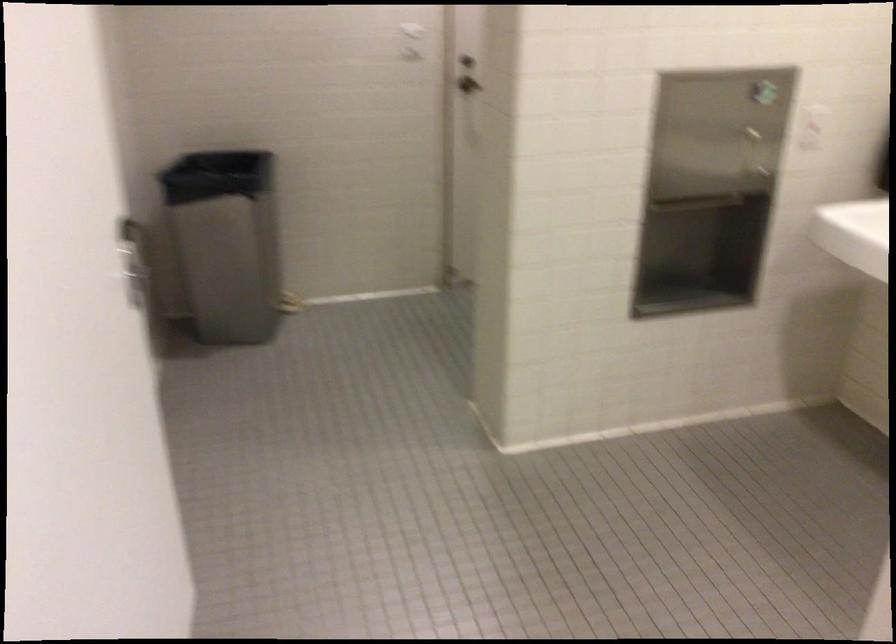
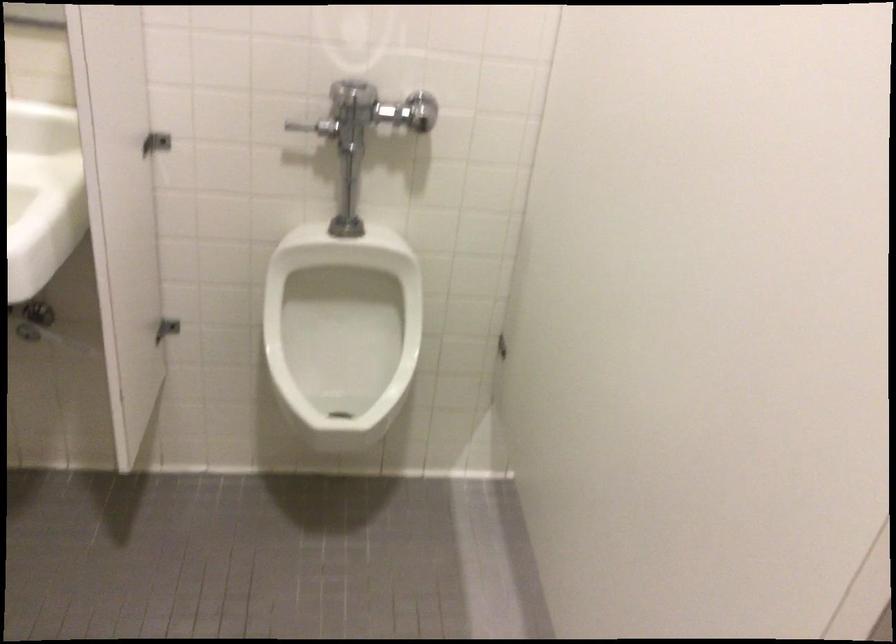
How did the camera likely rotate?

The rotation direction of the camera is right-down.